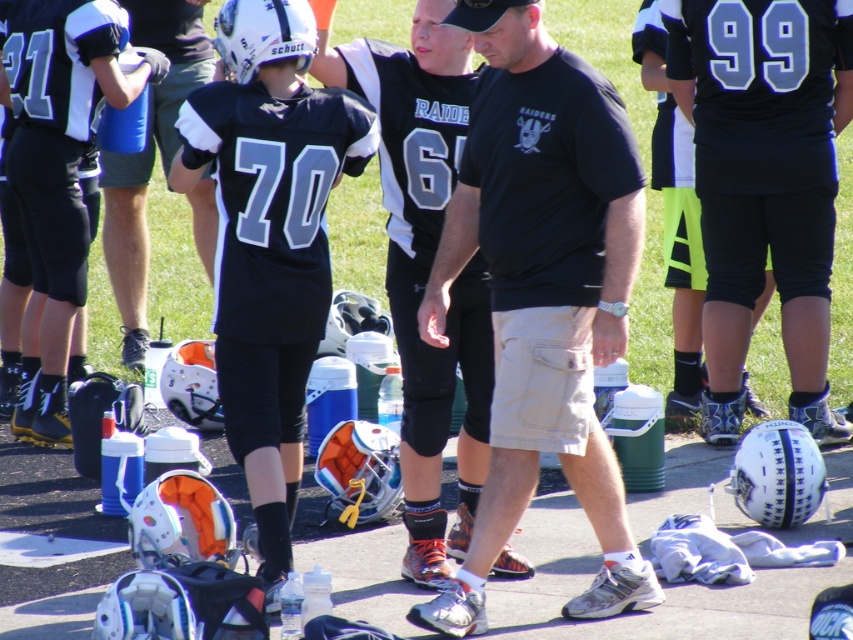
Does black cotton t-shirt at center appear on the left side of matte black helmet at center?

In fact, black cotton t-shirt at center is to the right of matte black helmet at center.

Does black cotton t-shirt at center appear over matte black helmet at center?

Incorrect, black cotton t-shirt at center is not positioned above matte black helmet at center.

Is point (498, 10) positioned after point (173, 48)?

No, it is not.

At what (x,y) coordinates should I click in order to perform the action: click on black cotton t-shirt at center. Please return your answer as a coordinate pair (x, y). The width and height of the screenshot is (853, 640). Looking at the image, I should click on (543, 292).